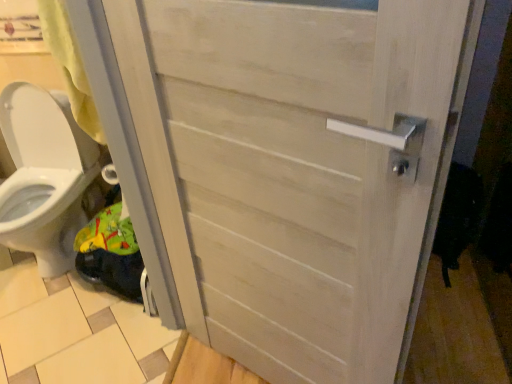
Question: Choose the correct answer: Is beige wood tile at lower left inside white glossy toilet at lower left or outside it?

Choices:
 (A) outside
 (B) inside

Answer: (A)

Question: Considering their positions, is beige wood tile at lower left located in front of or behind white glossy toilet at lower left?

Choices:
 (A) front
 (B) behind

Answer: (B)

Question: Estimate the real-world distances between objects in this image. Which object is closer to the beige wood tile at lower left?

Choices:
 (A) white wood door at center
 (B) white glossy toilet at lower left

Answer: (B)

Question: Based on their relative distances, which object is farther from the white wood door at center?

Choices:
 (A) white glossy toilet at lower left
 (B) beige wood tile at lower left

Answer: (A)